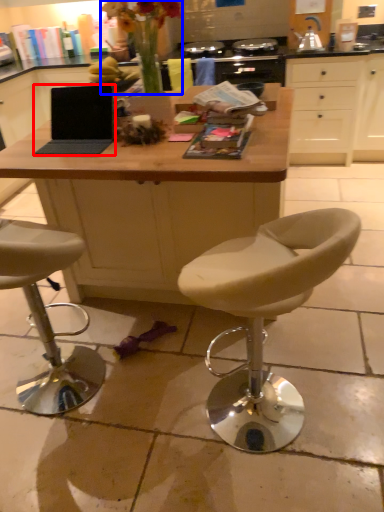
Question: Which object appears farthest to the camera in this image, laptop (highlighted by a red box) or floral arrangement (highlighted by a blue box)?

Choices:
 (A) laptop
 (B) floral arrangement

Answer: (A)